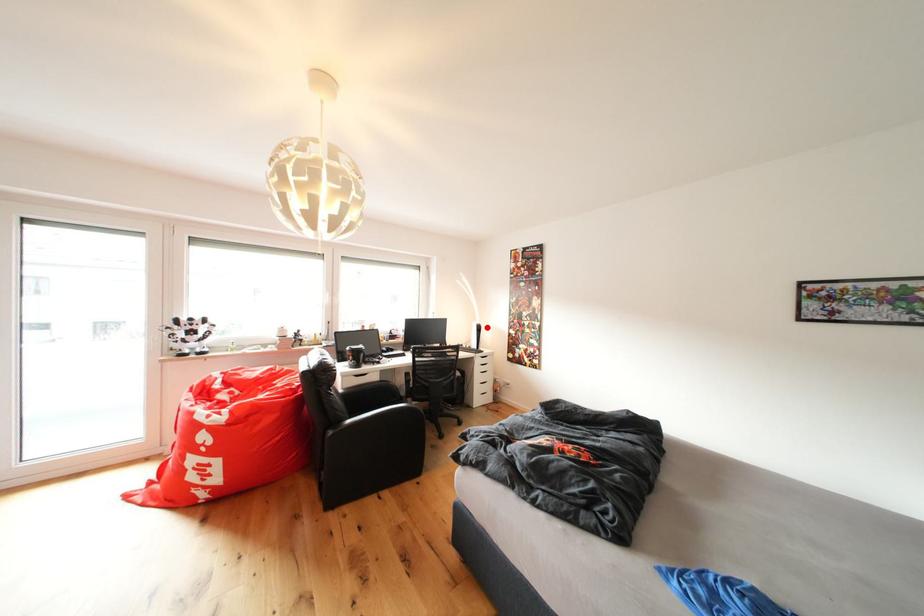
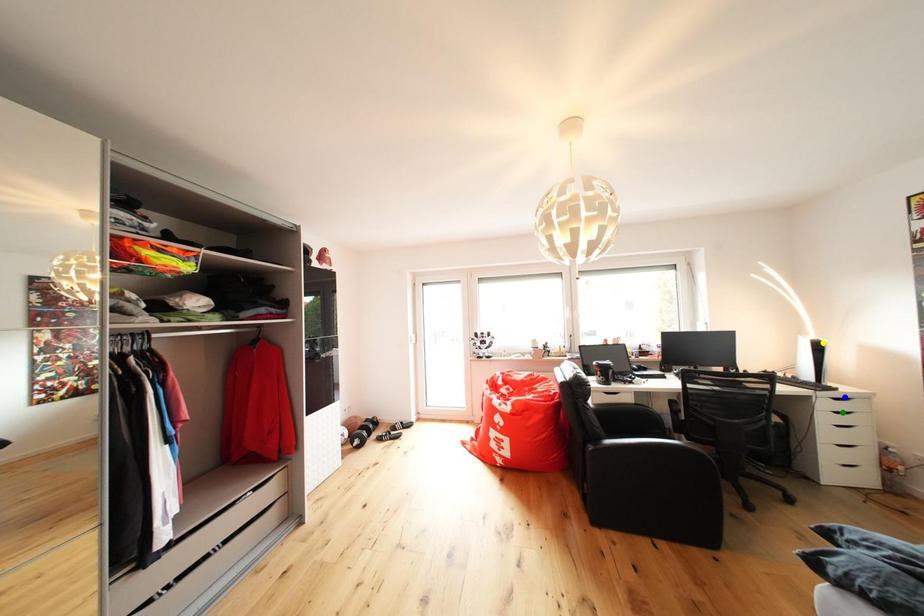
Question: I am providing you with two images of the same scene from different viewpoints. A red point is marked on the first image. You are given multiple points on the second image. In image 2, which mark is for the same physical point as the one in image 1?

Choices:
 (A) yellow point
 (B) blue point
 (C) green point

Answer: (A)